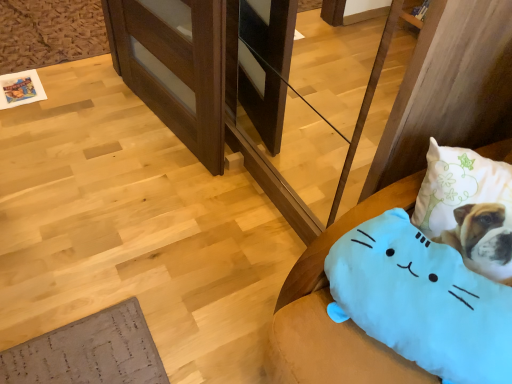
Find the location of a particular element. This screenshot has height=384, width=512. vacant space to the right of wooden at left is located at coordinates (240, 152).